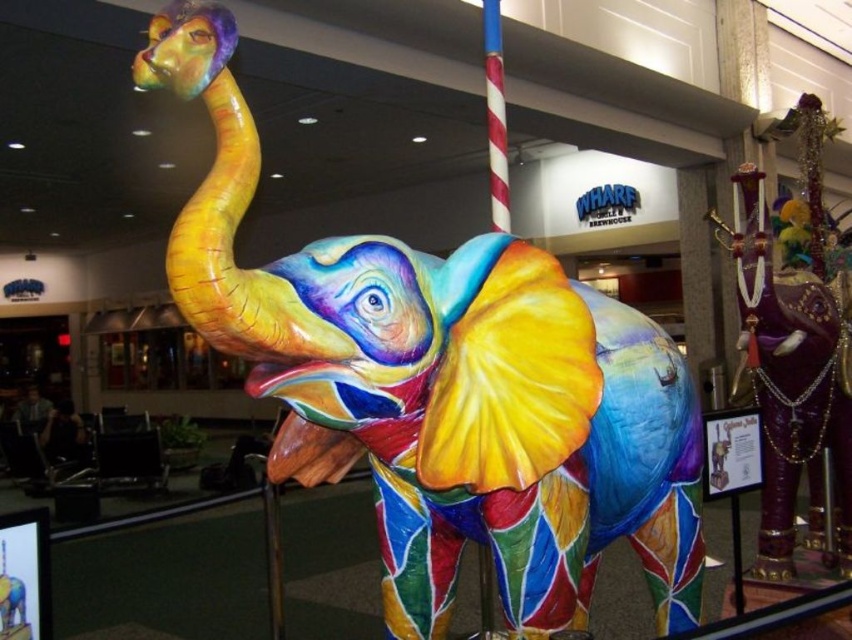
Which is more to the right, shiny purple elephant at right or red and white striped pole at center?

shiny purple elephant at right

Can you confirm if shiny purple elephant at right is taller than red and white striped pole at center?

Yes, shiny purple elephant at right is taller than red and white striped pole at center.

Find the location of a particular element. shiny purple elephant at right is located at coordinates (793, 346).

Locate an element on the screen. The image size is (852, 640). shiny purple elephant at right is located at coordinates (793, 346).

Can you confirm if multicolored painted elephant at center is taller than shiny purple elephant at right?

No.

Describe the element at coordinates (442, 385) in the screenshot. I see `multicolored painted elephant at center` at that location.

Between point (196, 253) and point (761, 260), which one is positioned in front?

Point (196, 253) is more forward.

Locate an element on the screen. Image resolution: width=852 pixels, height=640 pixels. multicolored painted elephant at center is located at coordinates (442, 385).

Which of these two, multicolored painted elephant at center or red and white striped pole at center, stands shorter?

red and white striped pole at center

Is point (508, 262) positioned before point (498, 16)?

Yes, point (508, 262) is in front of point (498, 16).

Find the location of a particular element. Image resolution: width=852 pixels, height=640 pixels. multicolored painted elephant at center is located at coordinates (442, 385).